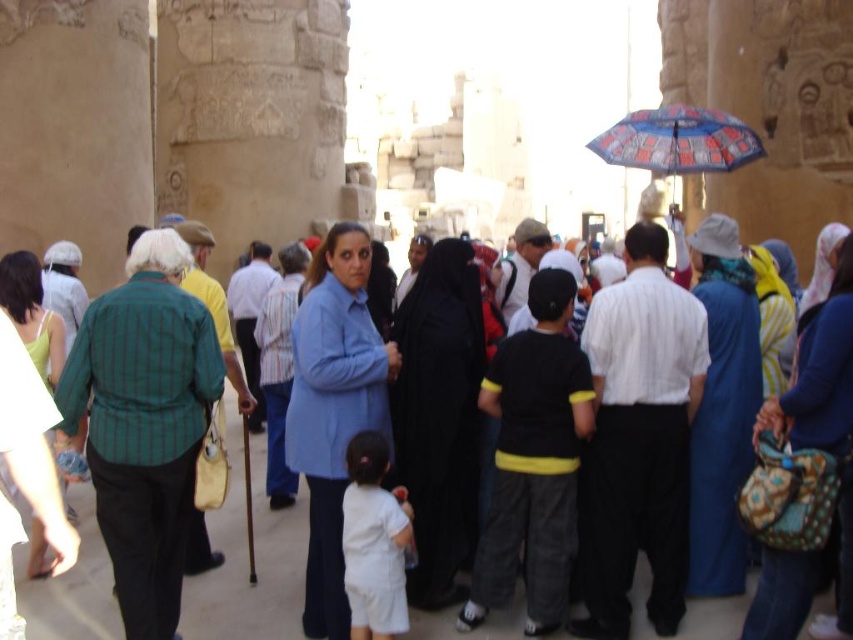
You are standing in the temple and want to take a photo of the blue cotton shirt at center and the blue printed fabric umbrella at upper right. Which object should you focus on first to ensure both are in the frame?

You should focus on the blue cotton shirt at center first because it is closer to the viewer than the blue printed fabric umbrella at upper right, ensuring both are in the frame.

You are standing in the ancient temple and want to move from point A to point B. Point A is at coordinates point (630, 512) and point B is at coordinates point (467, 356). Which point is closer to you when you start at point A?

Point A at coordinates point (630, 512) is closer to you since it is your starting position.

Based on the photo, you are standing at the entrance of the temple and want to find the black cotton shirt at center. According to the coordinates provided, where should you look relative to the entrance?

The black cotton shirt at center is located at coordinates point (532, 460). Since the entrance is at the bottom left corner, you should look towards the upper right direction to find it.